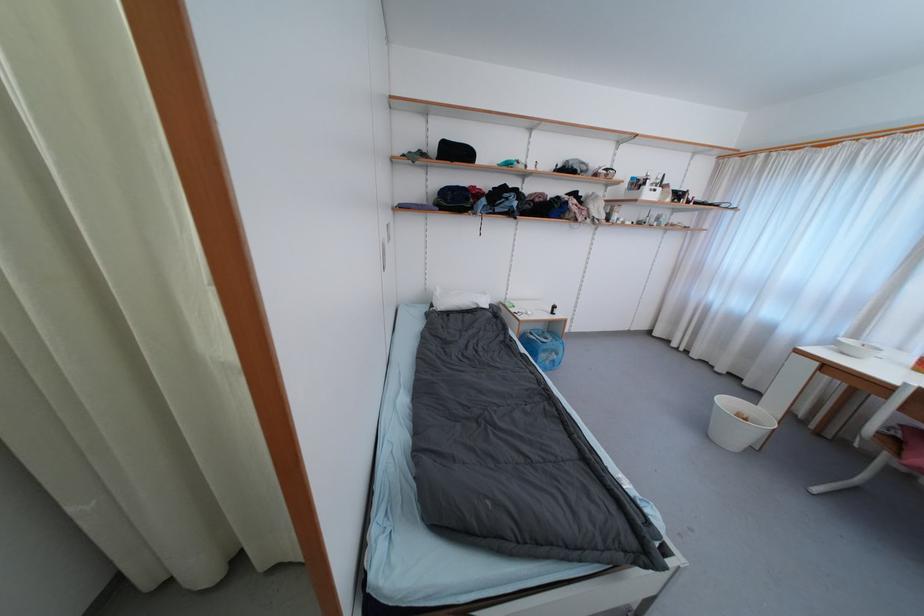
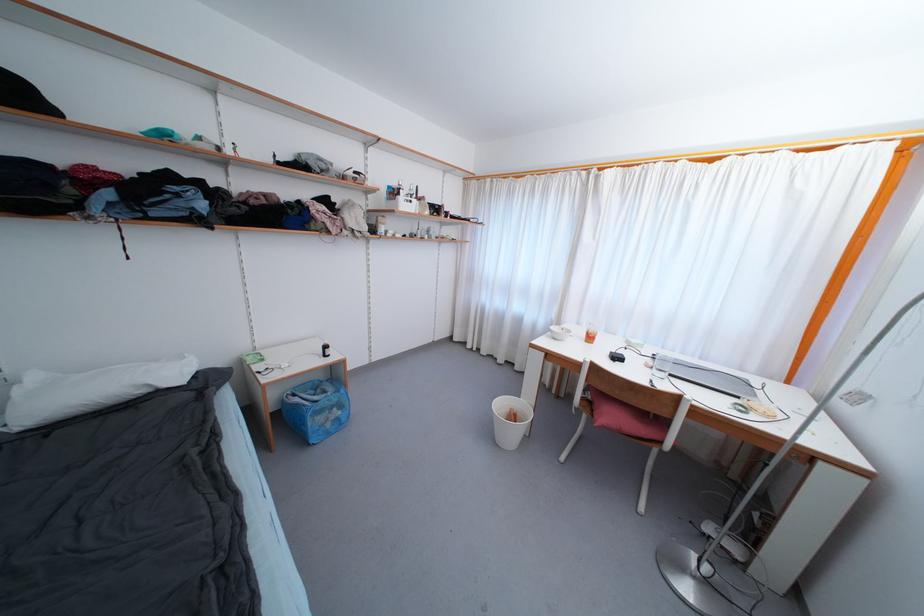
In the second image, find the point that corresponds to point 535,336 in the first image.

(298, 398)